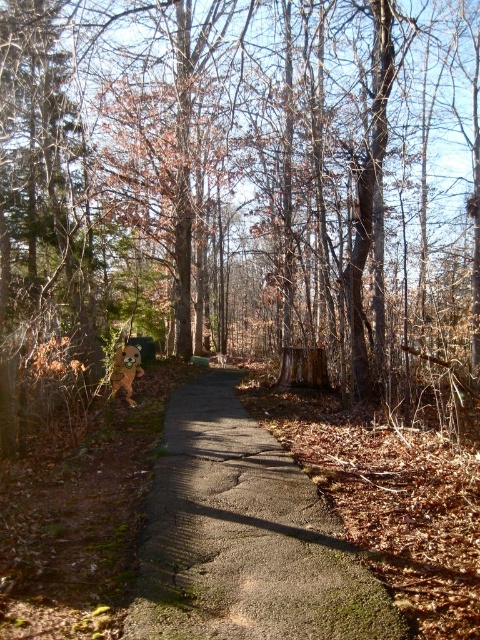
You are a hiker who has spotted both the brown rough wood at center and the brown furry dog at center along the forest path. Which object is positioned higher relative to the ground?

The brown rough wood at center is above the brown furry dog at center, so the brown rough wood at center is positioned higher relative to the ground.